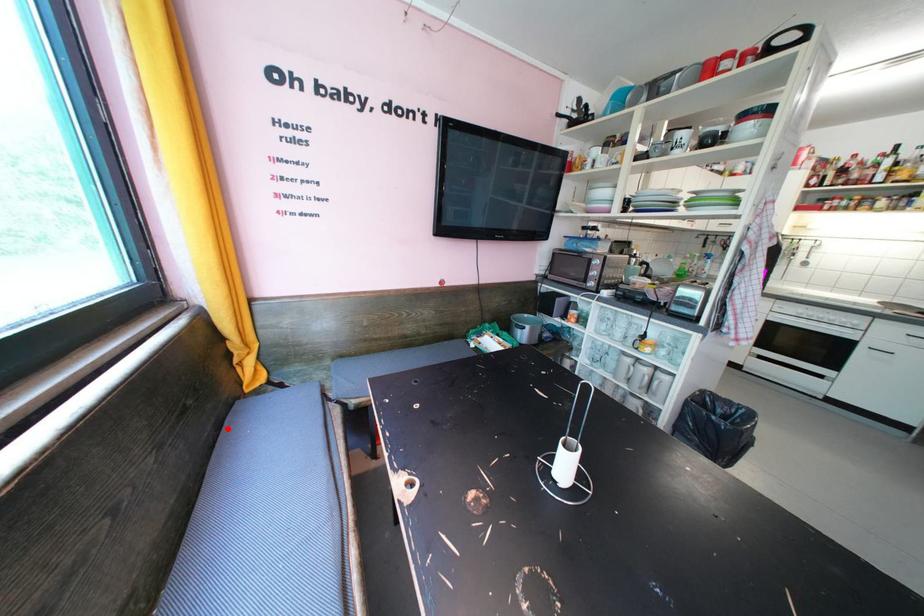
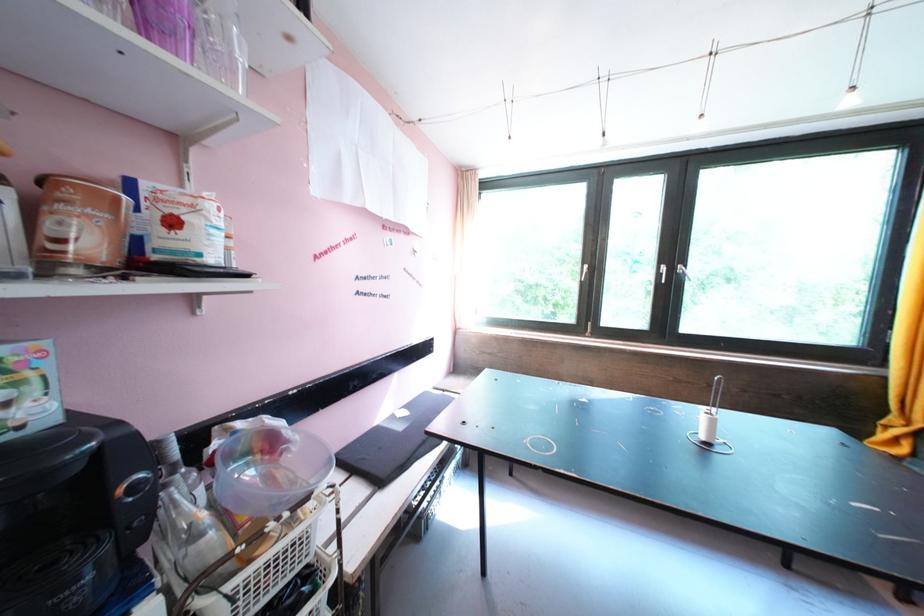
Question: I am providing you with two images of the same scene from different viewpoints. A red point is marked on the first image. Is the red point's position out of view in image 2?

Choices:
 (A) Yes
 (B) No

Answer: (A)